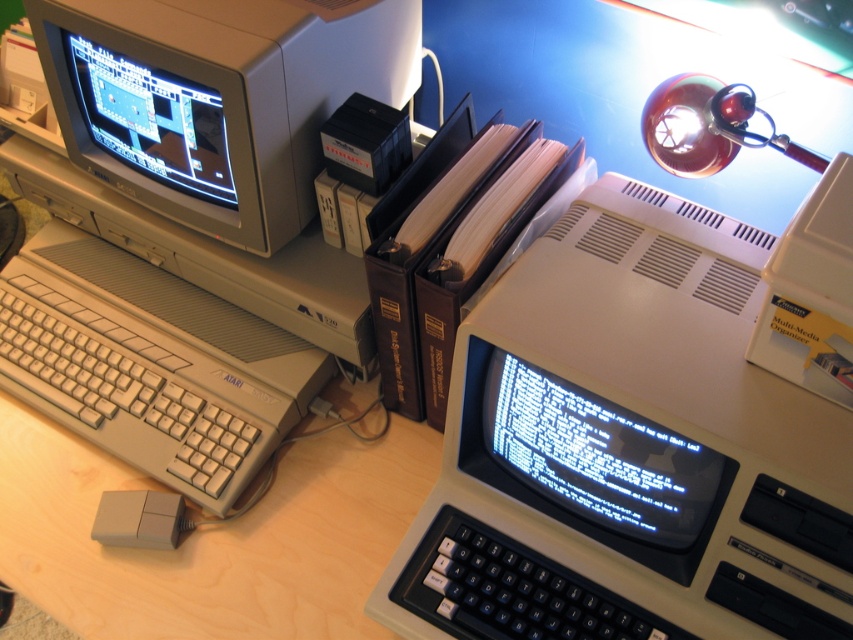
Question: From the image, what is the correct spatial relationship of beige plastic keyboard at left in relation to matte red lamp at upper right?

Choices:
 (A) above
 (B) below

Answer: (B)

Question: Which object appears closest to the camera in this image?

Choices:
 (A) matte gray monitor at upper left
 (B) shiny plastic monitor at upper left
 (C) beige plastic keyboard at left
 (D) matte red lamp at upper right

Answer: (A)

Question: Which of the following is the farthest from the observer?

Choices:
 (A) blue glossy monitor at center
 (B) beige plastic keyboard at left
 (C) matte red lamp at upper right

Answer: (B)

Question: Does beige plastic computer at center appear over matte red lamp at upper right?

Choices:
 (A) no
 (B) yes

Answer: (A)

Question: Observing the image, what is the correct spatial positioning of shiny plastic monitor at upper left in reference to matte red lamp at upper right?

Choices:
 (A) right
 (B) left

Answer: (B)

Question: Which is farther from the beige plastic computer at center?

Choices:
 (A) matte gray monitor at upper left
 (B) blue glossy monitor at center
 (C) beige plastic keyboard at left

Answer: (A)